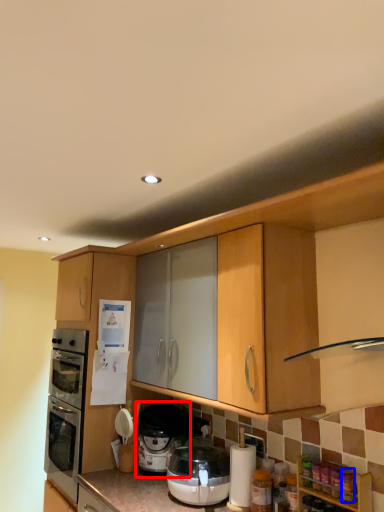
Question: Which of the following is the closest to the observer, pressure cooker (highlighted by a red box) or bottle (highlighted by a blue box)?

Choices:
 (A) pressure cooker
 (B) bottle

Answer: (B)